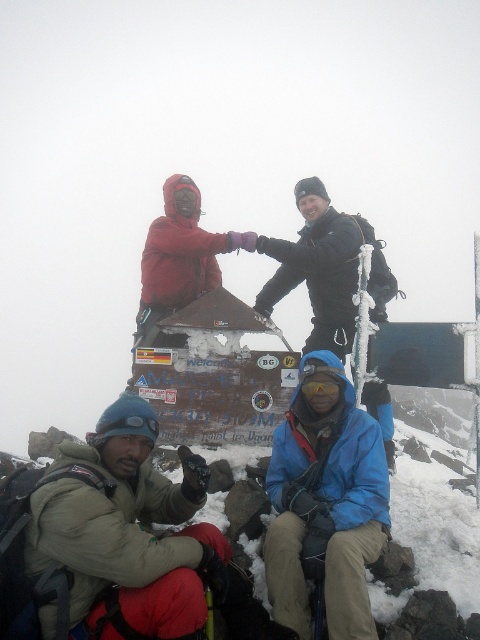
Question: Can you confirm if beige fleece jacket at lower left is wider than blue softshell jacket at lower right?

Choices:
 (A) no
 (B) yes

Answer: (B)

Question: Which point is closer to the camera?

Choices:
 (A) blue softshell jacket at lower right
 (B) beige fleece jacket at lower left

Answer: (B)

Question: Can you confirm if beige fleece jacket at lower left is wider than blue softshell jacket at lower right?

Choices:
 (A) yes
 (B) no

Answer: (A)

Question: Can you confirm if beige fleece jacket at lower left is positioned below blue softshell jacket at lower right?

Choices:
 (A) no
 (B) yes

Answer: (A)

Question: Which object is farther from the camera taking this photo?

Choices:
 (A) blue softshell jacket at lower right
 (B) beige fleece jacket at lower left

Answer: (A)